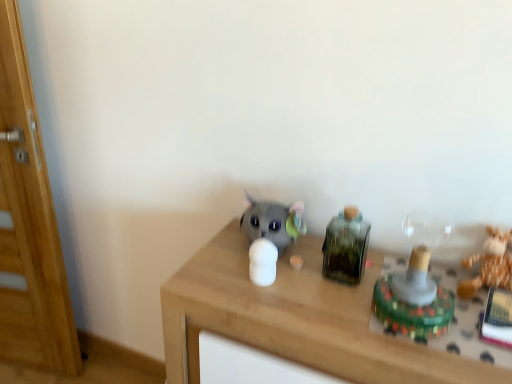
Question: From the image's perspective, relative to translucent plastic toy at right, the second toy positioned from the right, is brown plush toy at right, which is the fourth toy from left to right, above or below?

Choices:
 (A) above
 (B) below

Answer: (A)

Question: In the image, is brown plush toy at right, which is the fourth toy from left to right, positioned in front of or behind translucent plastic toy at right, the second toy positioned from the right?

Choices:
 (A) front
 (B) behind

Answer: (B)

Question: Which object is the farthest from the translucent plastic toy at right, the second toy positioned from the right?

Choices:
 (A) brown plush toy at right, which ranks as the 1th toy in right-to-left order
 (B) green glass bottle at center-right, arranged as the third toy when viewed from the right
 (C) wooden table at center
 (D) matte gray plush toy at center, arranged as the 4th toy when viewed from the right
 (E) wooden door at left

Answer: (E)

Question: Which is nearer to the translucent plastic toy at right, the third toy when ordered from left to right?

Choices:
 (A) wooden door at left
 (B) brown plush toy at right, which is the fourth toy from left to right
 (C) matte gray plush toy at center, arranged as the 4th toy when viewed from the right
 (D) green glass bottle at center-right, positioned as the second toy in left-to-right order
 (E) wooden table at center

Answer: (B)